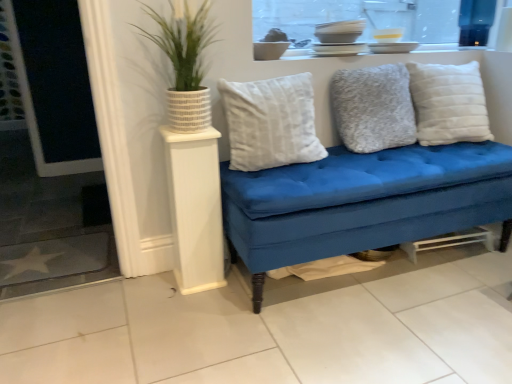
Locate an element on the screen. The height and width of the screenshot is (384, 512). vacant space that is to the left of white wood side table at left is located at coordinates (154, 279).